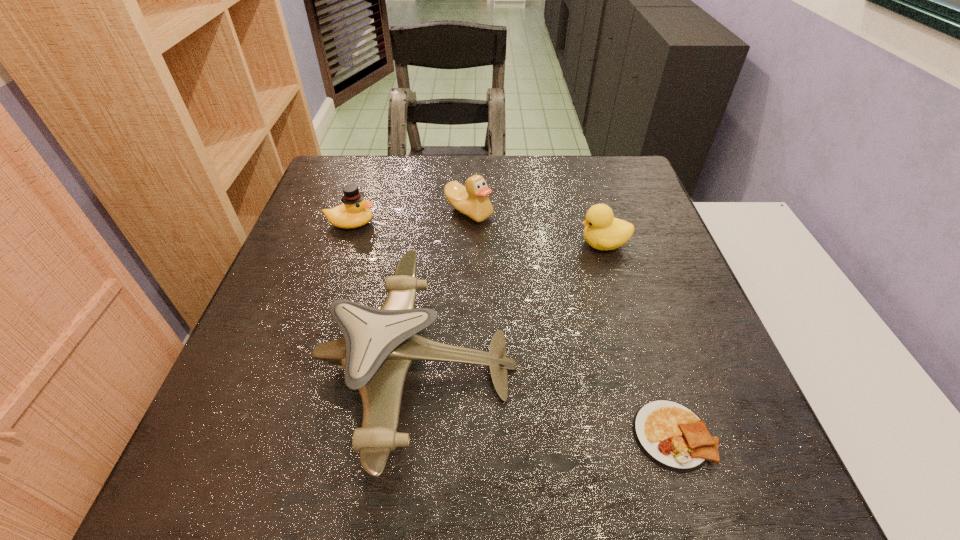
Identify the location of vacant point that satisfies the following two spatial constraints: 1. on the back side of the shortest object; 2. on the front-facing side of the rightmost duck. coord(612,244).

Locate an element on the screen. vacant space that satisfies the following two spatial constraints: 1. at the beak of the second duck from left to right; 2. on the front-facing side of the drone is located at coordinates (465, 366).

Locate an element on the screen. This screenshot has width=960, height=540. free space that satisfies the following two spatial constraints: 1. at the beak of the second duck from right to left; 2. on the front-facing side of the leftmost duck is located at coordinates click(x=468, y=223).

In order to click on free space that satisfies the following two spatial constraints: 1. on the back side of the shortest object; 2. on the front-facing side of the rightmost duck in this screenshot , I will do `click(612, 244)`.